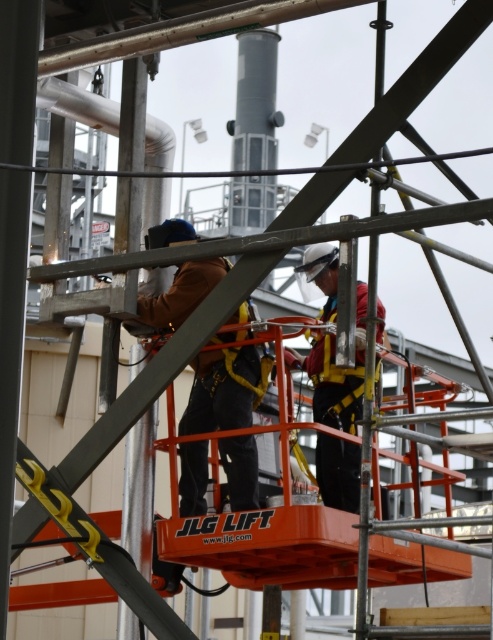
You are a safety inspector observing the workers on the red JLG Lift platform. You notice two items at the center of the platform. Which item is smaller in size between the brown leather jacket at center and the matte white helmet at center?

The brown leather jacket at center is smaller than the matte white helmet at center according to the description.

You are a safety inspector reviewing the image. You notice the brown leather jacket at center and the matte white helmet at center. According to safety protocols, which object should be visible to ensure proper safety compliance?

The matte white helmet at center should be visible because it is behind the brown leather jacket at center, indicating that the worker is not properly wearing the helmet, which violates safety protocols.

You are a safety inspector reviewing this industrial site image. You notice two points marked in the scene. Which point, point (230,461) or point (331,500), is closer to your viewpoint as the observer?

Point (230,461) is closer to the camera than point (331,500).